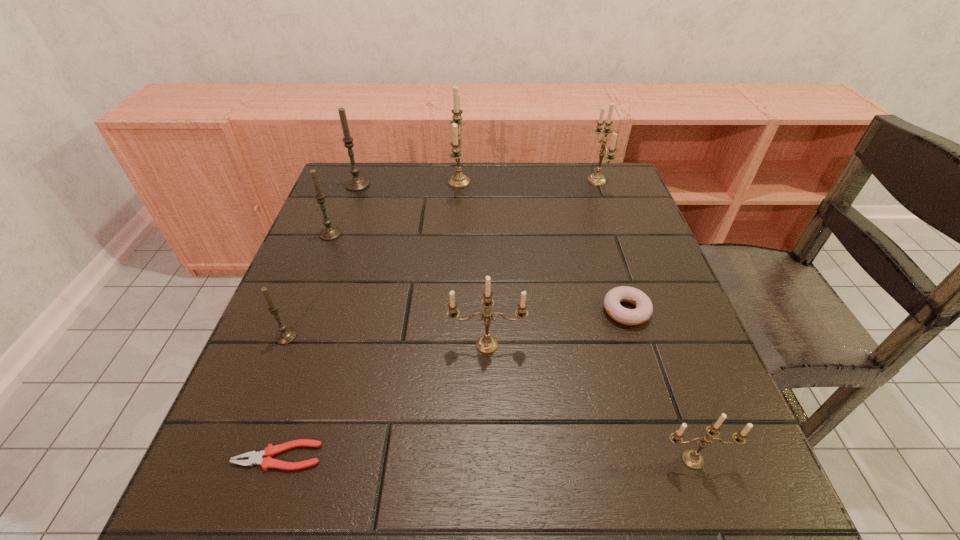
In order to click on the eighth tallest object in this screenshot , I will do (644, 308).

What are the coordinates of `brown doughnut` in the screenshot? It's located at (644, 308).

Where is `pliers`? pliers is located at coordinates (267, 462).

I want to click on vacant area situated on the left of the tallest candle, so click(426, 183).

Identify the location of free space located 0.060m on the left of the second biggest metallic candle. (566, 180).

Find the location of a particular element. vacant region located 0.390m on the right of the farthest gray candle is located at coordinates (508, 185).

Where is `free space located 0.390m on the right of the second biggest gray candle`? This screenshot has width=960, height=540. free space located 0.390m on the right of the second biggest gray candle is located at coordinates tap(500, 234).

The width and height of the screenshot is (960, 540). I want to click on free region located on the front of the second smallest metallic candle, so click(488, 392).

Find the location of a particular element. vacant space located on the back of the nearest gray candle is located at coordinates (335, 214).

Locate an element on the screen. The height and width of the screenshot is (540, 960). vacant area situated on the left of the nearest metallic candle is located at coordinates (554, 460).